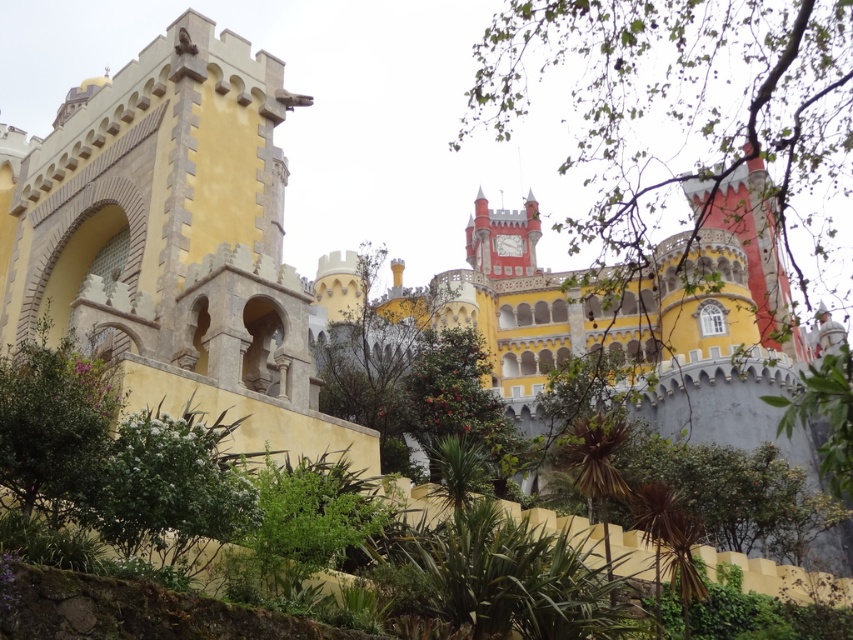
Question: Is green leafy bush at lower center positioned at the back of green leafy bush at left?

Choices:
 (A) no
 (B) yes

Answer: (B)

Question: Which object is farther from the camera taking this photo?

Choices:
 (A) green leafy bush at left
 (B) green leafy bush at lower center

Answer: (B)

Question: Which object appears closest to the camera in this image?

Choices:
 (A) green leafy bush at left
 (B) green leafy bush at lower center

Answer: (A)

Question: Can you confirm if green leafy bush at lower center is wider than green leafy bush at left?

Choices:
 (A) yes
 (B) no

Answer: (B)

Question: Is green leafy bush at lower center above green leafy bush at left?

Choices:
 (A) no
 (B) yes

Answer: (A)